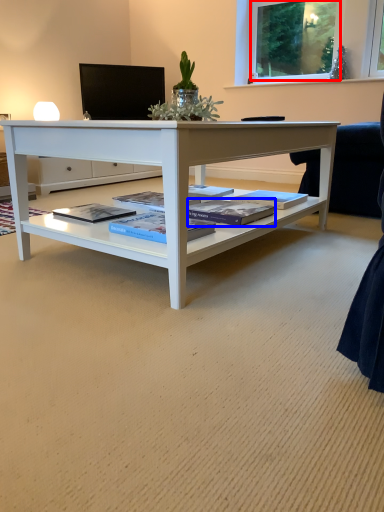
Question: Which point is further to the camera, window screen (highlighted by a red box) or magazine (highlighted by a blue box)?

Choices:
 (A) window screen
 (B) magazine

Answer: (A)